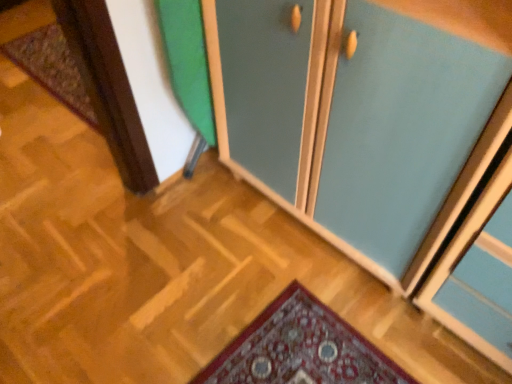
Where is `vacant space situated on the left part of teal matte cabinet at center`? The height and width of the screenshot is (384, 512). vacant space situated on the left part of teal matte cabinet at center is located at coordinates (188, 259).